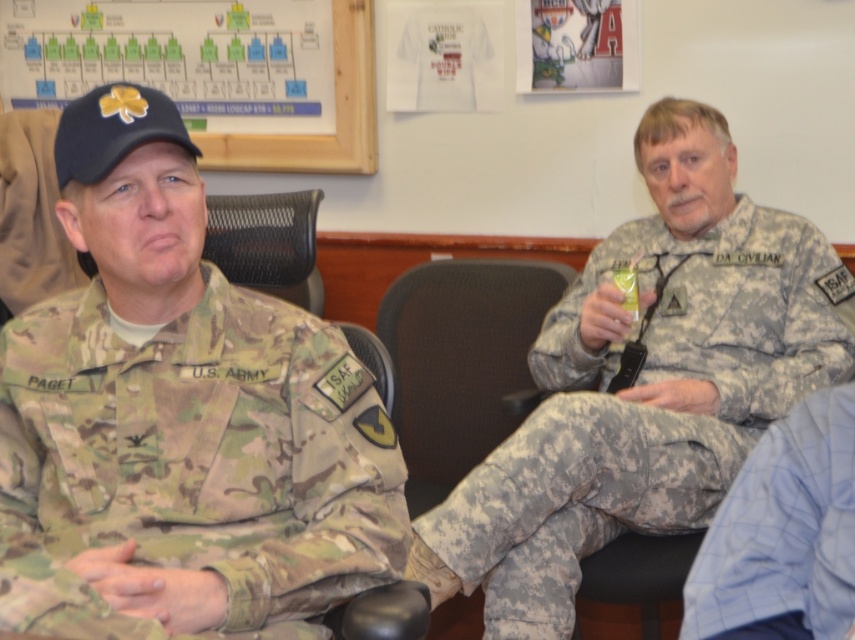
You are a tailor who needs to determine which garment has a greater width to decide which requires more fabric. You observe the camouflage fabric uniform at right and the blue plaid shirt at lower right. Which one has a larger width?

The camouflage fabric uniform at right has a greater width than the blue plaid shirt at lower right, so it requires more fabric.

You are a photographer setting up for a portrait. You need to ensure that both the camouflage fabric uniform at right and the wooden frame at upper left are in focus. Which object should you adjust your camera focus to prioritize for better depth of field?

The camouflage fabric uniform at right is closer to the viewer than the wooden frame at upper left. To ensure both are in focus, prioritize focusing on the wooden frame at upper left since it is further away, as depth of field typically extends further behind the point of focus than in front.